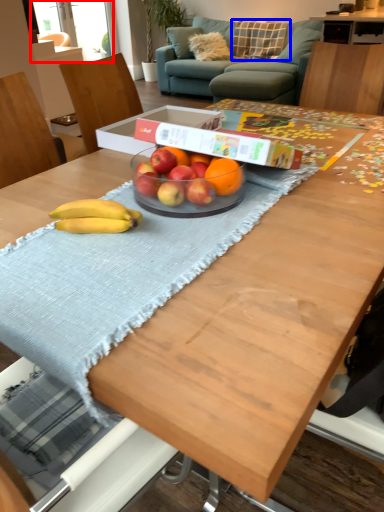
Question: Which object is further to the camera taking this photo, window screen (highlighted by a red box) or pillow (highlighted by a blue box)?

Choices:
 (A) window screen
 (B) pillow

Answer: (A)